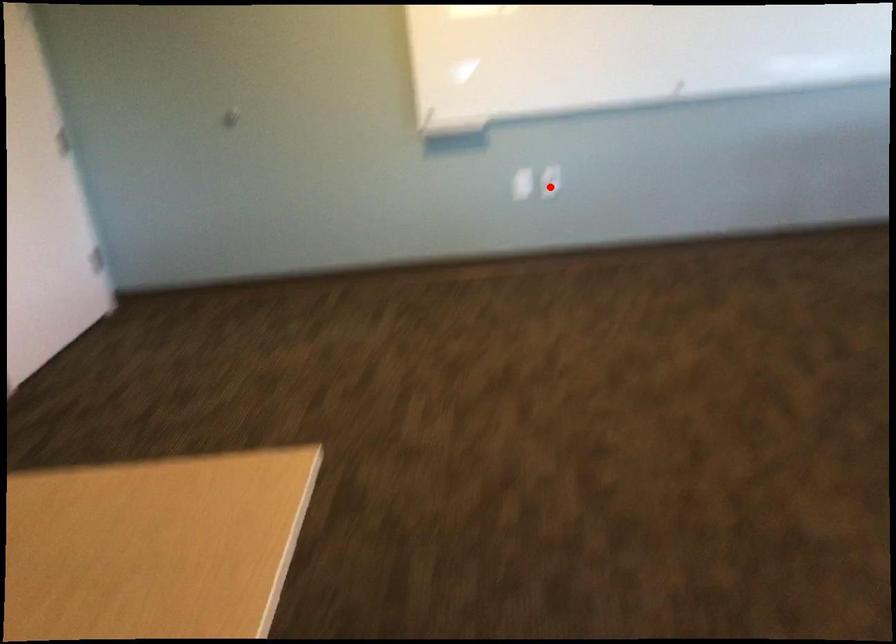
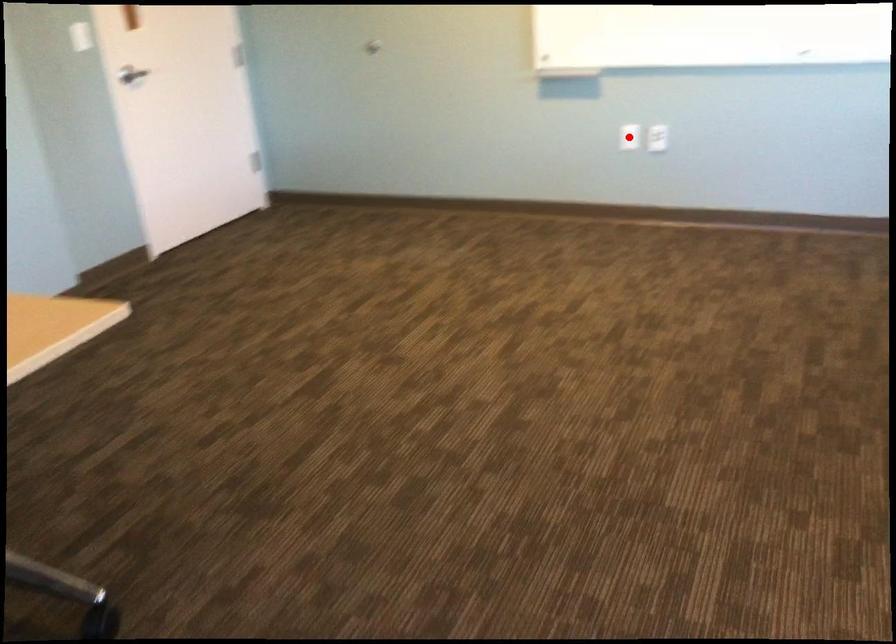
I am providing you with two images of the same scene from different viewpoints. A red point is marked on the first image and another point is marked on the second image. Does the point marked in image1 correspond to the same location as the one in image2?

No